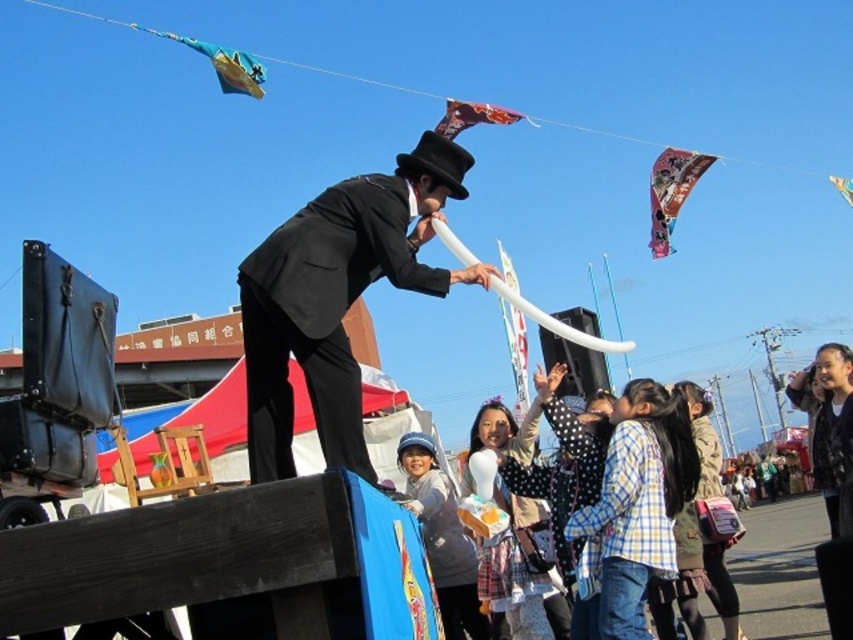
Question: Is shiny black suit at center smaller than polka dot dress at lower right?

Choices:
 (A) yes
 (B) no

Answer: (A)

Question: Among these points, which one is farthest from the camera?

Choices:
 (A) (469, 104)
 (B) (840, 188)

Answer: (B)

Question: Which object is the farthest from the metallic silver kite at upper right?

Choices:
 (A) shiny black suit at center
 (B) multicolored paper kite at upper right

Answer: (A)

Question: Does shiny black suit at center appear on the right side of polka dot dress at lower right?

Choices:
 (A) yes
 (B) no

Answer: (B)

Question: Which object is the farthest from the polka dot dress at lower right?

Choices:
 (A) multicolored paper kite at upper right
 (B) shiny black suit at center

Answer: (B)

Question: Considering the relative positions of shiny black suit at center and printed fabric kite at upper center in the image provided, where is shiny black suit at center located with respect to printed fabric kite at upper center?

Choices:
 (A) below
 (B) above

Answer: (A)